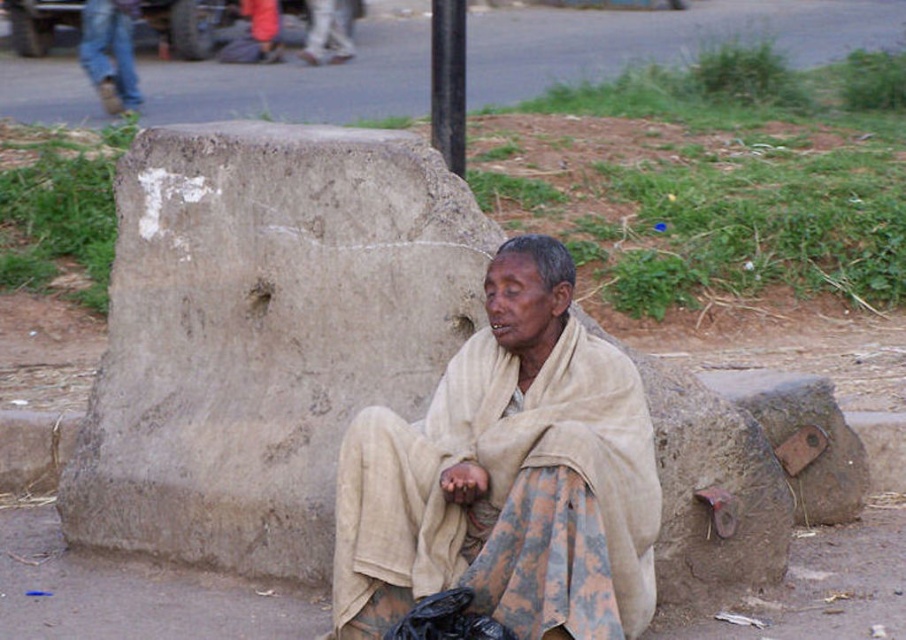
You are standing at the origin point in the image and want to move towards the gray concrete block at center. What are the coordinates you should aim for to reach it?

The gray concrete block at center is located at coordinates point (264, 333), so you should aim for that point to reach it.

You are a delivery person trying to secure a package on your bike rack. The beige fabric at center and the black metal pole at upper center are both in your line of sight. Which item can you use to tie down the package more effectively?

The beige fabric at center is larger in size than the black metal pole at upper center, so it can be used to tie down the package more effectively because its larger size allows for better coverage and securing.